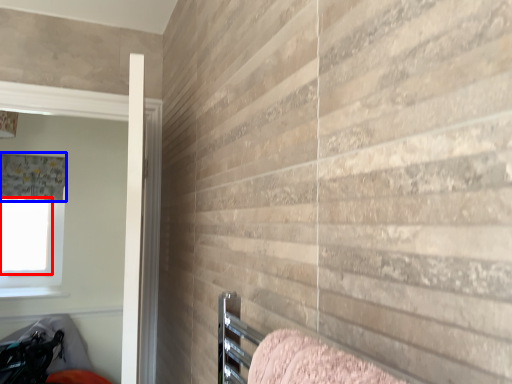
Question: Which point is closer to the camera, window screen (highlighted by a red box) or curtain (highlighted by a blue box)?

Choices:
 (A) window screen
 (B) curtain

Answer: (B)